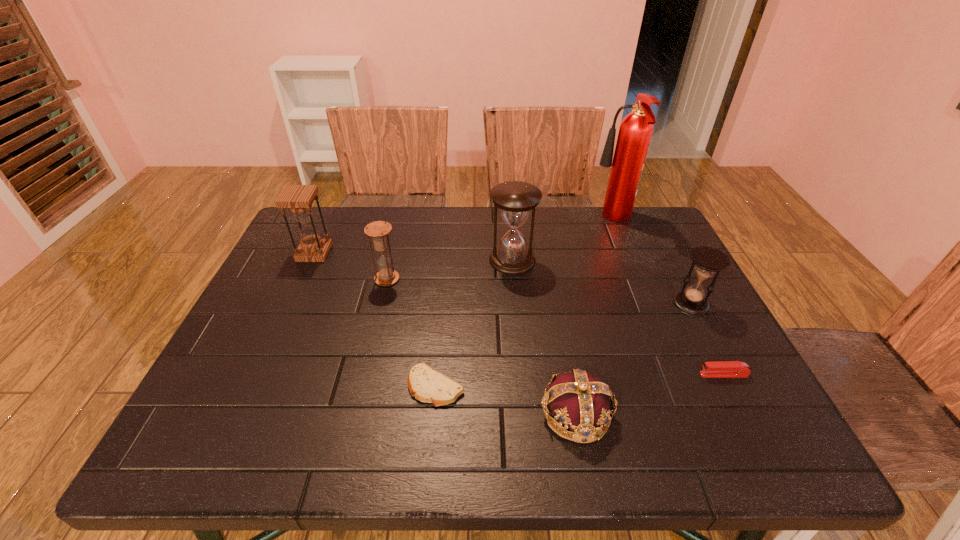
I want to click on blank area located 0.380m on the front-facing side of the stapler, so click(524, 374).

Where is `vacant space located on the front-facing side of the stapler`? The width and height of the screenshot is (960, 540). vacant space located on the front-facing side of the stapler is located at coordinates (598, 374).

Where is `free space located 0.230m on the left of the shortest object`? Image resolution: width=960 pixels, height=540 pixels. free space located 0.230m on the left of the shortest object is located at coordinates (298, 387).

This screenshot has height=540, width=960. I want to click on fire extinguisher located at the far edge, so click(x=635, y=131).

At what (x,y) coordinates should I click in order to perform the action: click on object that is at the near edge. Please return your answer as a coordinate pair (x, y). The height and width of the screenshot is (540, 960). Looking at the image, I should click on (580, 401).

What are the coordinates of `object at the left edge` in the screenshot? It's located at (298, 198).

Identify the location of fire extinguisher present at the right edge. The height and width of the screenshot is (540, 960). (635, 131).

At what (x,y) coordinates should I click in order to perform the action: click on hourglass that is at the right edge. Please return your answer as a coordinate pair (x, y). Looking at the image, I should click on (707, 260).

At what (x,y) coordinates should I click in order to perform the action: click on stapler that is at the right edge. Please return your answer as a coordinate pair (x, y). Looking at the image, I should click on (716, 369).

Find the location of a particular element. This screenshot has width=960, height=540. object that is at the far left corner is located at coordinates (298, 198).